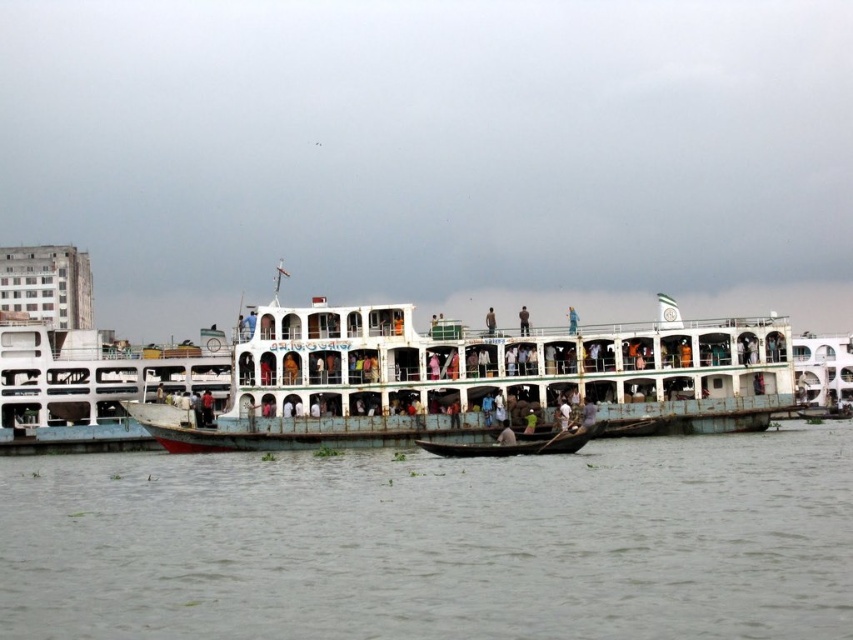
Question: Can you confirm if white painted metal ferry at center is positioned below wooden boat at center?

Choices:
 (A) yes
 (B) no

Answer: (B)

Question: Which is nearer to the blue fabric person at center?

Choices:
 (A) grayish water at center
 (B) light blue fabric shirt at center

Answer: (B)

Question: Is grayish water at center to the right of dark blue fabric at upper center from the viewer's perspective?

Choices:
 (A) yes
 (B) no

Answer: (B)

Question: Among these points, which one is nearest to the camera?

Choices:
 (A) (494, 317)
 (B) (480, 496)

Answer: (B)

Question: Is white painted metal ferry at center bigger than blue fabric person at center?

Choices:
 (A) yes
 (B) no

Answer: (A)

Question: Among these points, which one is farthest from the camera?

Choices:
 (A) (514, 576)
 (B) (572, 314)
 (C) (637, 396)
 (D) (465, 444)

Answer: (B)